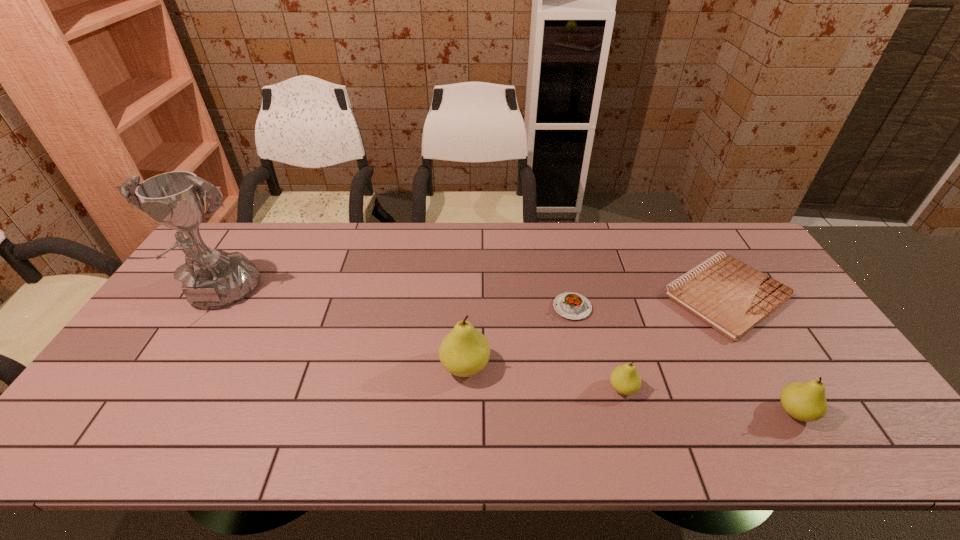
At what (x,y) coordinates should I click in order to perform the action: click on blank space located on the back of the leftmost pear. Please return your answer as a coordinate pair (x, y). The height and width of the screenshot is (540, 960). Looking at the image, I should click on (467, 322).

Find the location of a particular element. This screenshot has height=540, width=960. vacant space located on the back of the third shortest object is located at coordinates (594, 285).

This screenshot has height=540, width=960. Find the location of `free space located on the back of the rightmost pear`. free space located on the back of the rightmost pear is located at coordinates (737, 315).

In order to click on vacant point located 0.140m on the back of the shortest object in this screenshot , I will do 689,233.

In order to click on vacant region located on the left of the fifth tallest object in this screenshot , I will do `click(506, 308)`.

Find the location of a particular element. free space located on the side with emblem of the tallest object is located at coordinates (185, 346).

Locate an element on the screen. object at the far edge is located at coordinates (732, 297).

Locate an element on the screen. This screenshot has width=960, height=540. object that is at the left edge is located at coordinates (212, 279).

At what (x,y) coordinates should I click in order to perform the action: click on pear that is at the right edge. Please return your answer as a coordinate pair (x, y). The width and height of the screenshot is (960, 540). Looking at the image, I should click on tap(806, 401).

Identify the location of notebook at the right edge. This screenshot has width=960, height=540. (732, 297).